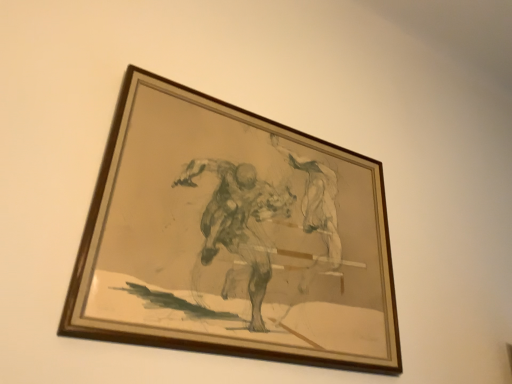
Describe the element at coordinates (233, 237) in the screenshot. The height and width of the screenshot is (384, 512). I see `brown wooden picture frame at upper center` at that location.

Identify the location of brown wooden picture frame at upper center. This screenshot has height=384, width=512. (233, 237).

The height and width of the screenshot is (384, 512). Identify the location of brown wooden picture frame at upper center. (233, 237).